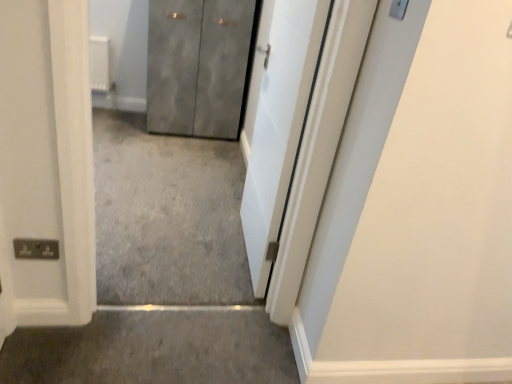
Identify the location of metallic gray cabinet at center, the first door from the left. This screenshot has height=384, width=512. (198, 66).

Find the location of a particular element. This screenshot has height=384, width=512. metallic gray cabinet at center, which ranks as the 2th door in front-to-back order is located at coordinates (198, 66).

Can gray carpet at lower center be found inside white smooth door at center, the 1th door positioned from the front?

No, white smooth door at center, the 1th door positioned from the front, does not contain gray carpet at lower center.

Between white smooth door at center, the 1th door positioned from the front, and gray carpet at lower center, which one has smaller size?

gray carpet at lower center is smaller.

Is white smooth door at center, acting as the second door starting from the left, closer to camera compared to gray carpet at lower center?

That is True.

Identify the location of concrete below the white smooth door at center, the 1th door positioned from the front (from a real-world perspective). This screenshot has width=512, height=384. (154, 349).

In terms of height, does gray carpet at lower center look taller or shorter compared to white smooth door at center, the 1th door positioned from the front?

In the image, gray carpet at lower center appears to be shorter than white smooth door at center, the 1th door positioned from the front.

Which is correct: gray carpet at lower center is inside white smooth door at center, marked as the first door in a right-to-left arrangement, or outside of it?

gray carpet at lower center exists outside the volume of white smooth door at center, marked as the first door in a right-to-left arrangement.

What's the angular difference between gray carpet at lower center and white smooth door at center, the 1th door positioned from the front,'s facing directions?

gray carpet at lower center and white smooth door at center, the 1th door positioned from the front, are facing 88.4 degrees away from each other.

Which is more distant, (x=234, y=96) or (x=314, y=65)?

Point (x=234, y=96)

In the image, is metallic gray cabinet at center, which is the second door in right-to-left order, on the left side or the right side of white smooth door at center, marked as the first door in a right-to-left arrangement?

metallic gray cabinet at center, which is the second door in right-to-left order, is to the left of white smooth door at center, marked as the first door in a right-to-left arrangement.

Who is shorter, metallic gray cabinet at center, marked as the 1th door in a back-to-front arrangement, or white smooth door at center, acting as the second door starting from the left?

Standing shorter between the two is metallic gray cabinet at center, marked as the 1th door in a back-to-front arrangement.

Does gray carpet at lower center have a greater height compared to metallic gray cabinet at center, marked as the 1th door in a back-to-front arrangement?

In fact, gray carpet at lower center may be shorter than metallic gray cabinet at center, marked as the 1th door in a back-to-front arrangement.

Which point is more distant from viewer, [283,348] or [183,25]?

Point [183,25]

Looking at their sizes, would you say gray carpet at lower center is wider or thinner than metallic gray cabinet at center, which is the second door in right-to-left order?

In the image, gray carpet at lower center appears to be more narrow than metallic gray cabinet at center, which is the second door in right-to-left order.

How many degrees apart are the facing directions of gray carpet at lower center and metallic gray cabinet at center, the first door from the left?

The facing directions of gray carpet at lower center and metallic gray cabinet at center, the first door from the left, are 179 degrees apart.

From the image's perspective, between white smooth door at center, marked as the first door in a right-to-left arrangement, and metallic gray cabinet at center, marked as the 1th door in a back-to-front arrangement, who is located below?

white smooth door at center, marked as the first door in a right-to-left arrangement, from the image's perspective.

Which is more to the right, white smooth door at center, acting as the second door starting from the left, or metallic gray cabinet at center, the first door from the left?

white smooth door at center, acting as the second door starting from the left, is more to the right.

Could you tell me if white smooth door at center, acting as the second door starting from the left, is turned towards metallic gray cabinet at center, which ranks as the 2th door in front-to-back order?

No, white smooth door at center, acting as the second door starting from the left, is not aimed at metallic gray cabinet at center, which ranks as the 2th door in front-to-back order.

Is white smooth door at center, the 1th door positioned from the front, closer to camera compared to metallic gray cabinet at center, marked as the 1th door in a back-to-front arrangement?

Yes, white smooth door at center, the 1th door positioned from the front, is in front of metallic gray cabinet at center, marked as the 1th door in a back-to-front arrangement.

Where is `door that is the 1st object above the gray carpet at lower center (from a real-world perspective)`? This screenshot has height=384, width=512. door that is the 1st object above the gray carpet at lower center (from a real-world perspective) is located at coordinates (198, 66).

Between metallic gray cabinet at center, which is the second door in right-to-left order, and gray carpet at lower center, which one has smaller size?

gray carpet at lower center.

Is metallic gray cabinet at center, which ranks as the 2th door in front-to-back order, not near gray carpet at lower center?

metallic gray cabinet at center, which ranks as the 2th door in front-to-back order, is positioned a significant distance from gray carpet at lower center.

From their relative heights in the image, would you say metallic gray cabinet at center, marked as the 1th door in a back-to-front arrangement, is taller or shorter than gray carpet at lower center?

Considering their sizes, metallic gray cabinet at center, marked as the 1th door in a back-to-front arrangement, has more height than gray carpet at lower center.

Where is `concrete behind the white smooth door at center, acting as the second door starting from the left`? The height and width of the screenshot is (384, 512). concrete behind the white smooth door at center, acting as the second door starting from the left is located at coordinates (154, 349).

I want to click on concrete below the white smooth door at center, marked as the first door in a right-to-left arrangement (from the image's perspective), so click(x=154, y=349).

Looking at this image, based on their spatial positions, is white smooth door at center, acting as the second door starting from the left, or metallic gray cabinet at center, marked as the 1th door in a back-to-front arrangement, closer to gray carpet at lower center?

white smooth door at center, acting as the second door starting from the left.

Considering their positions, is white smooth door at center, marked as the first door in a right-to-left arrangement, positioned closer to metallic gray cabinet at center, which ranks as the 2th door in front-to-back order, than gray carpet at lower center?

The object closer to metallic gray cabinet at center, which ranks as the 2th door in front-to-back order, is white smooth door at center, marked as the first door in a right-to-left arrangement.

When comparing their distances from white smooth door at center, the 1th door positioned from the front, does gray carpet at lower center or metallic gray cabinet at center, which is the second door in right-to-left order, seem closer?

Among the two, gray carpet at lower center is located nearer to white smooth door at center, the 1th door positioned from the front.

When comparing their distances from metallic gray cabinet at center, the first door from the left, does gray carpet at lower center or white smooth door at center, positioned as the second door in back-to-front order, seem closer?

white smooth door at center, positioned as the second door in back-to-front order, is closer to metallic gray cabinet at center, the first door from the left.

Based on their spatial positions, is metallic gray cabinet at center, which ranks as the 2th door in front-to-back order, or white smooth door at center, marked as the first door in a right-to-left arrangement, closer to gray carpet at lower center?

white smooth door at center, marked as the first door in a right-to-left arrangement, is closer to gray carpet at lower center.

Looking at the image, which one is located further to white smooth door at center, positioned as the second door in back-to-front order, metallic gray cabinet at center, which is the second door in right-to-left order, or gray carpet at lower center?

Among the two, metallic gray cabinet at center, which is the second door in right-to-left order, is located further to white smooth door at center, positioned as the second door in back-to-front order.

The width and height of the screenshot is (512, 384). Find the location of `concrete between white smooth door at center, positioned as the second door in back-to-front order, and metallic gray cabinet at center, which is the second door in right-to-left order, in the front-back direction`. concrete between white smooth door at center, positioned as the second door in back-to-front order, and metallic gray cabinet at center, which is the second door in right-to-left order, in the front-back direction is located at coordinates (154, 349).